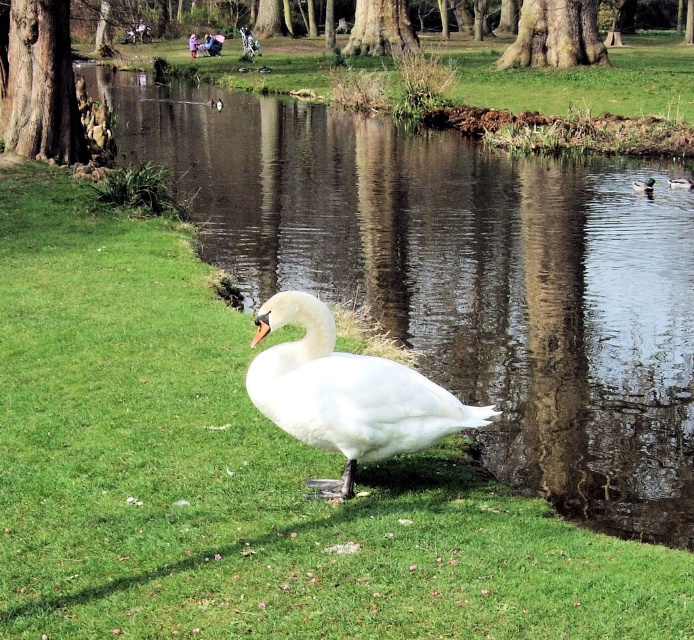
You are standing in the park and want to take a photo of the swan on the grassy bank. The camera you are using has a maximum zoom range of 50 feet. Is the point where the swan is located, which is at point (x=651, y=182), within your camera range?

The point (x=651, y=182) is 74.18 feet away from the viewer. Since the camera has a maximum zoom range of 50 feet, the swan at point (x=651, y=182) is beyond the camera range and cannot be captured clearly without moving closer.

Looking at this image, you are standing at the edge of the water in the park scene and see two points marked in the image. Which point is closer to you, point (593, 356) or point (688, 180)?

Point (593, 356) is in front of point (688, 180), so it is closer to you.

You are standing in the park and see the swan on the grassy bank. There is a point marked at coordinates (643, 186). What object is located at that point?

The point at (643, 186) marks the green glossy duck at right.